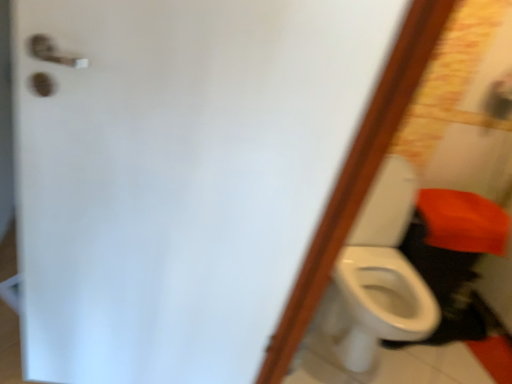
What do you see at coordinates (463, 106) in the screenshot?
I see `matte orange mirror at right` at bounding box center [463, 106].

Identify the location of matte orange mirror at right. (463, 106).

Find the location of a particular element. matte orange mirror at right is located at coordinates (463, 106).